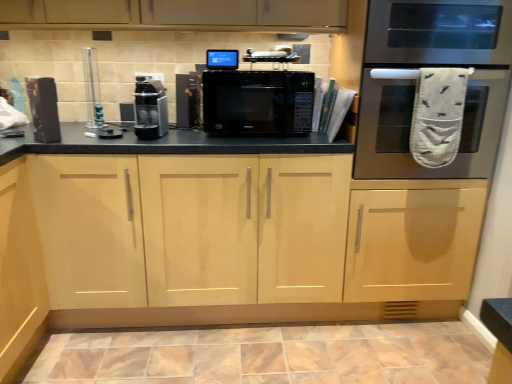
Question: Considering the positions of marble-like ceramic tile at lower center and black matte microwave at center in the image, is marble-like ceramic tile at lower center taller or shorter than black matte microwave at center?

Choices:
 (A) tall
 (B) short

Answer: (B)

Question: Considering the relative positions of marble-like ceramic tile at lower center and black matte microwave at center in the image provided, is marble-like ceramic tile at lower center to the left or to the right of black matte microwave at center?

Choices:
 (A) left
 (B) right

Answer: (B)

Question: Which of these objects is positioned closest to the black matte microwave at center?

Choices:
 (A) satin black coffee machine at center, which appears as the third appliance when viewed from the left
 (B) stainless steel oven at right
 (C) clear glass vase at upper left, which is the second appliance from left to right
 (D) light wood cabinet at center
 (E) matte black speaker at left, the fifth appliance when ordered from right to left

Answer: (A)

Question: Estimate the real-world distances between objects in this image. Which object is farther from the blue glossy monitor at upper center, the first appliance viewed from the right?

Choices:
 (A) black matte microwave at center
 (B) clear glass vase at upper left, which is the second appliance from left to right
 (C) matte black speaker at left, arranged as the 1th appliance when viewed from the left
 (D) satin black coffee machine at center, which appears as the third appliance when viewed from the left
 (E) black matte microwave at center, the second appliance in the right-to-left sequence

Answer: (C)